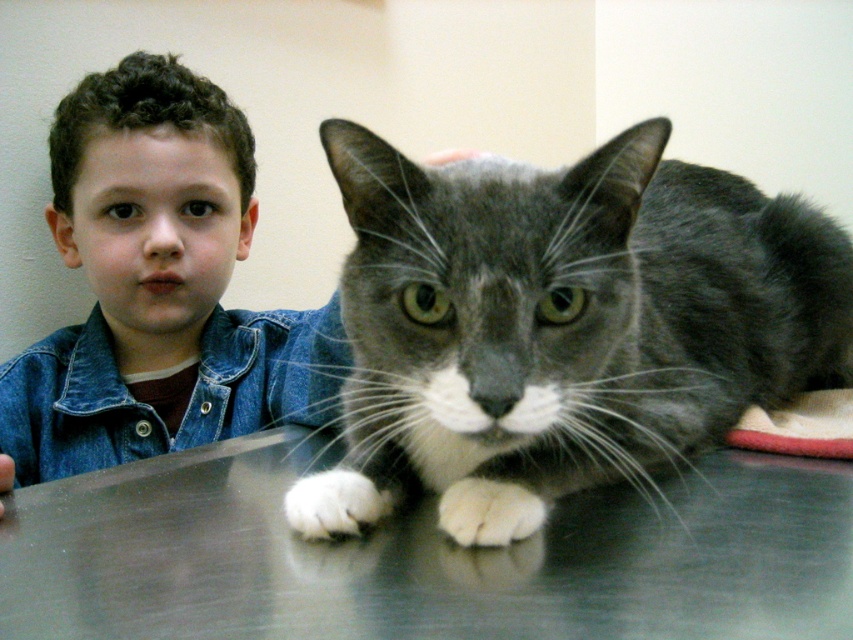
You are a veterinarian holding a 30 cm long medical tool. You need to place it on the table where the boy and the cat are. The table is at point (749, 540). Can you fit the tool on the table without it hanging off?

The point (749, 540) is 66.10 centimeters away from the viewer. Since the medical tool is only 30 cm long, it can be placed on the table at point (749, 540) without hanging off as the distance is sufficient.